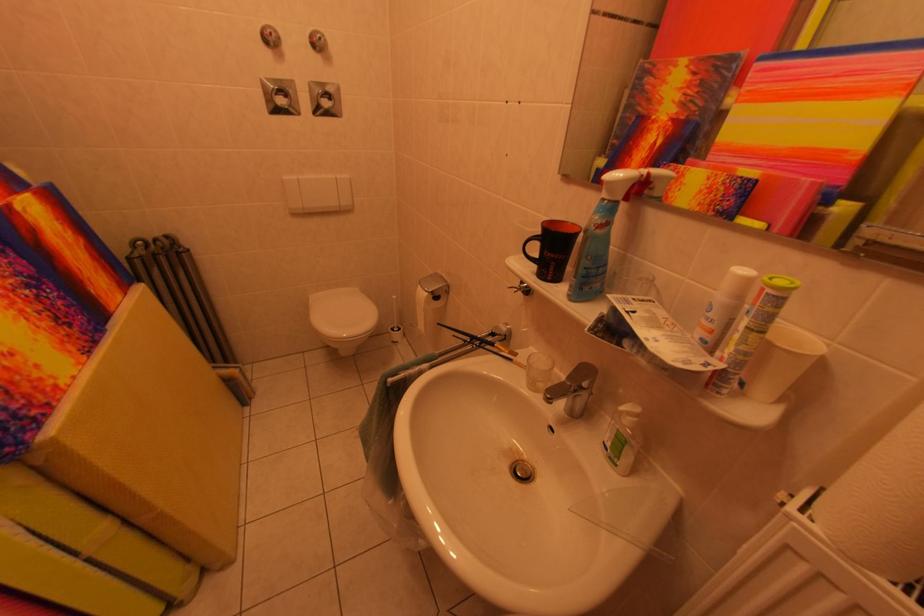
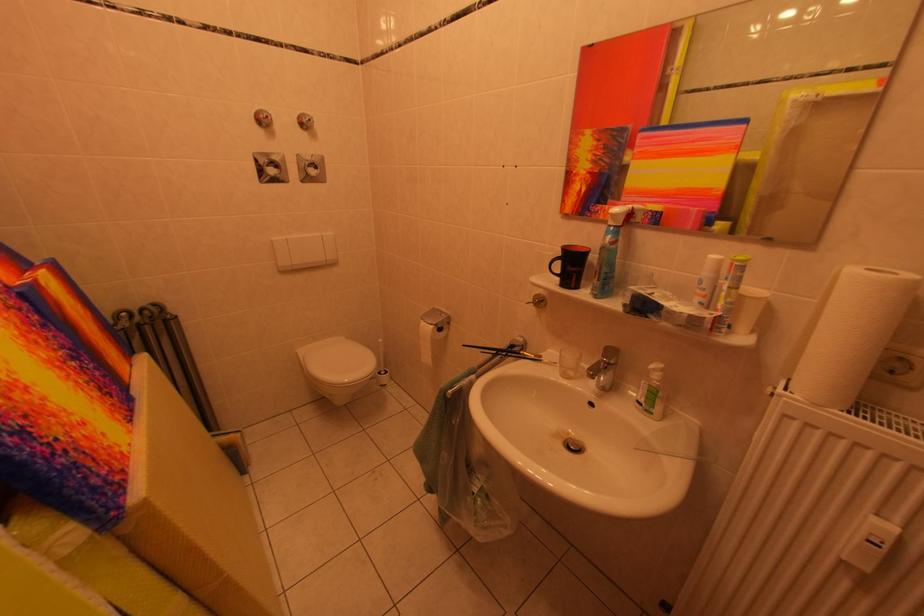
Which direction would the cameraman need to move to produce the second image?

The movement direction of the cameraman is left, backward.